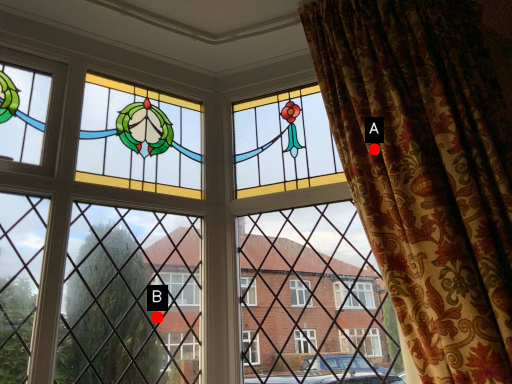
Question: Two points are circled on the image, labeled by A and B beside each circle. Which point is closer to the camera taking this photo?

Choices:
 (A) A is closer
 (B) B is closer

Answer: (A)